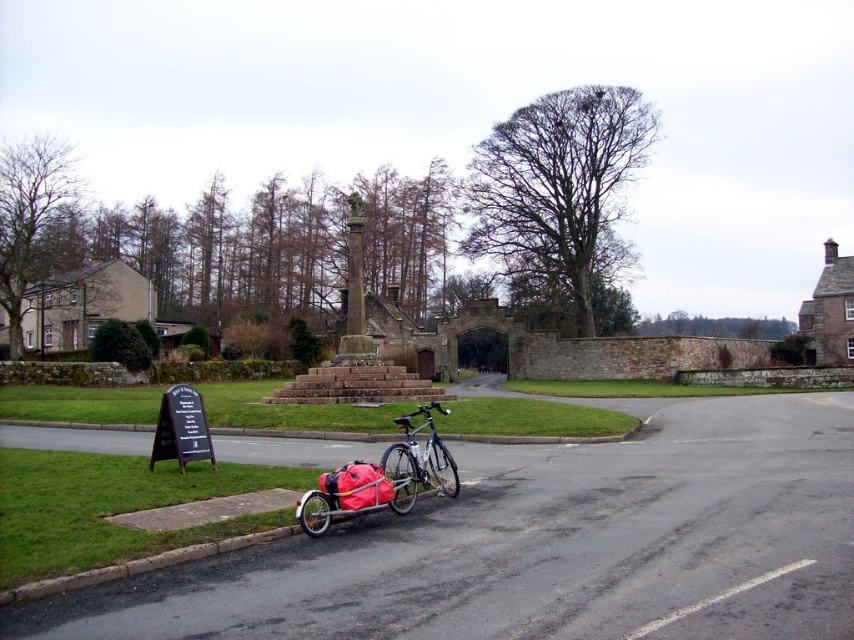
Describe the element at coordinates (379, 477) in the screenshot. I see `silver metallic bicycle at lower center` at that location.

Is silver metallic bicycle at lower center taller than silver metallic bicycle at center?

No.

Is point (373, 472) positioned after point (427, 461)?

No.

The width and height of the screenshot is (854, 640). In order to click on silver metallic bicycle at lower center in this screenshot , I will do `click(379, 477)`.